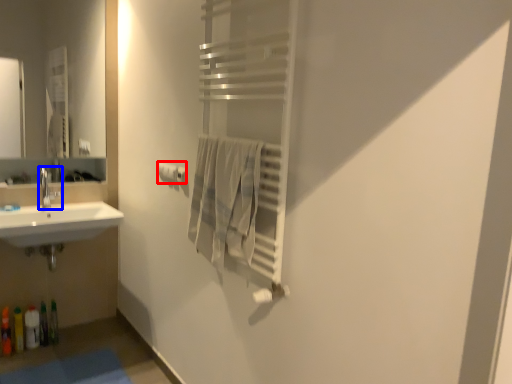
Question: Which point is closer to the camera, toilet paper (highlighted by a red box) or tap (highlighted by a blue box)?

Choices:
 (A) toilet paper
 (B) tap

Answer: (A)